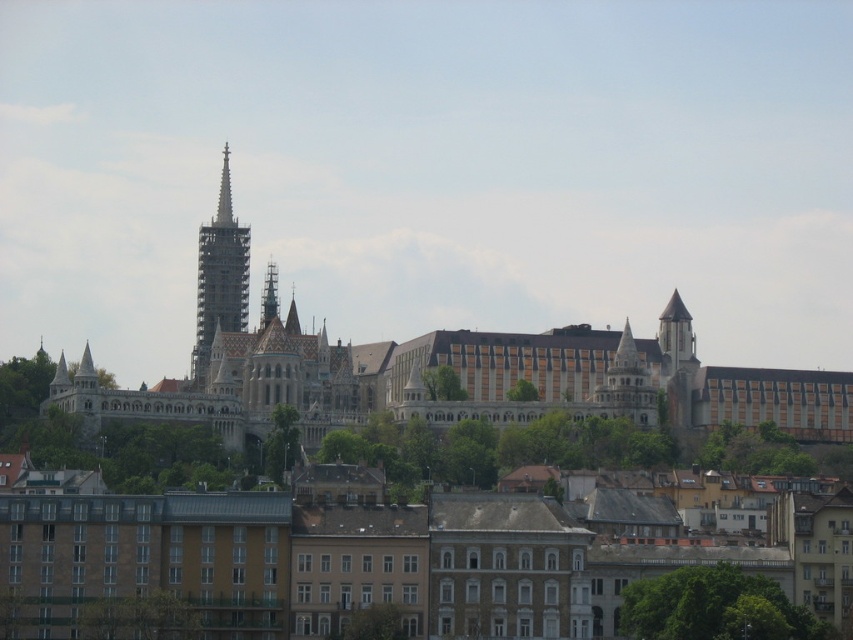
You are standing in the historic cityscape and want to determine the spatial relationship between two points marked in the image. Which point is closer to you, point (413, 349) or point (260, 296)?

Point (413, 349) is in front of point (260, 296), so it is closer to you.

You are an architect visiting the city and notice two spires in the central area of the image. Which one is taller between the white stone spire at center and the smooth stone spire at center?

The white stone spire at center is taller than the smooth stone spire at center according to the description provided.

You are an architect visiting the city and want to take a photo of the white stone castle at center and the white stone spire at center. Which one should you focus on first to ensure both are in the frame without moving the camera?

The white stone castle at center is in front of the white stone spire at center, so you should focus on the white stone castle at center first to ensure both are visible in the frame without moving the camera.